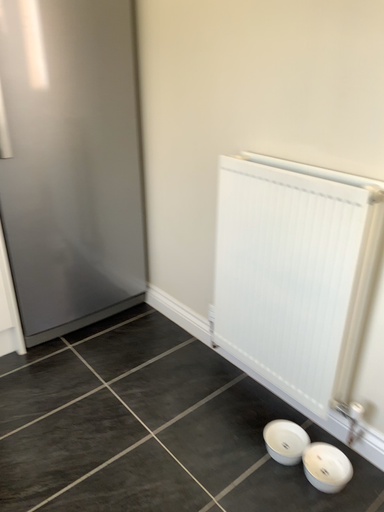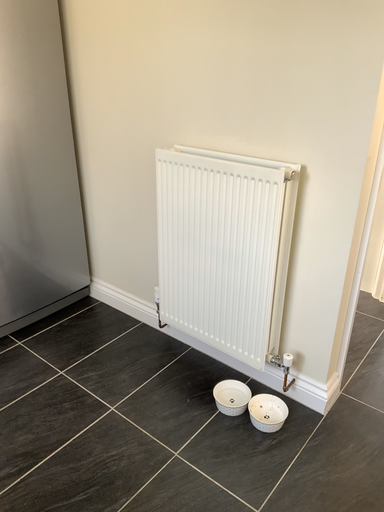
Question: How did the camera likely rotate when shooting the video?

Choices:
 (A) rotated left
 (B) rotated right

Answer: (B)